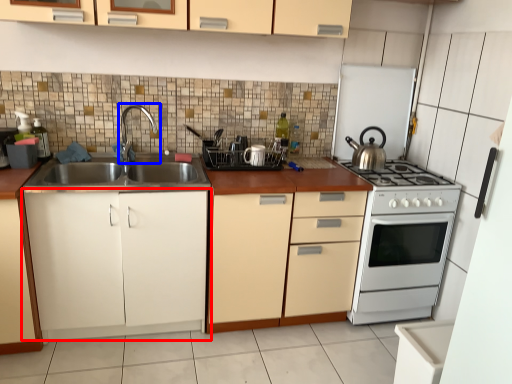
Question: Which object is closer to the camera taking this photo, cabinetry (highlighted by a red box) or tap (highlighted by a blue box)?

Choices:
 (A) cabinetry
 (B) tap

Answer: (A)